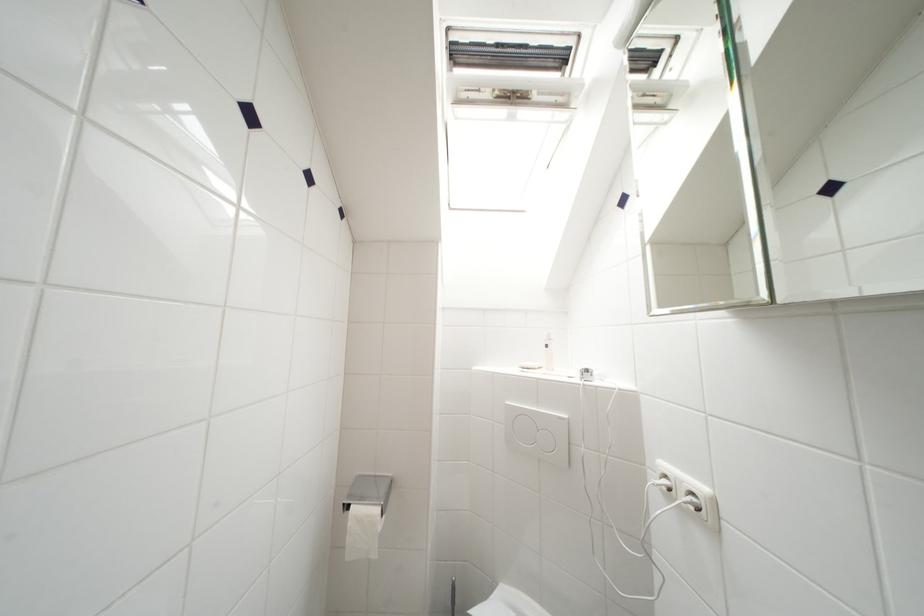
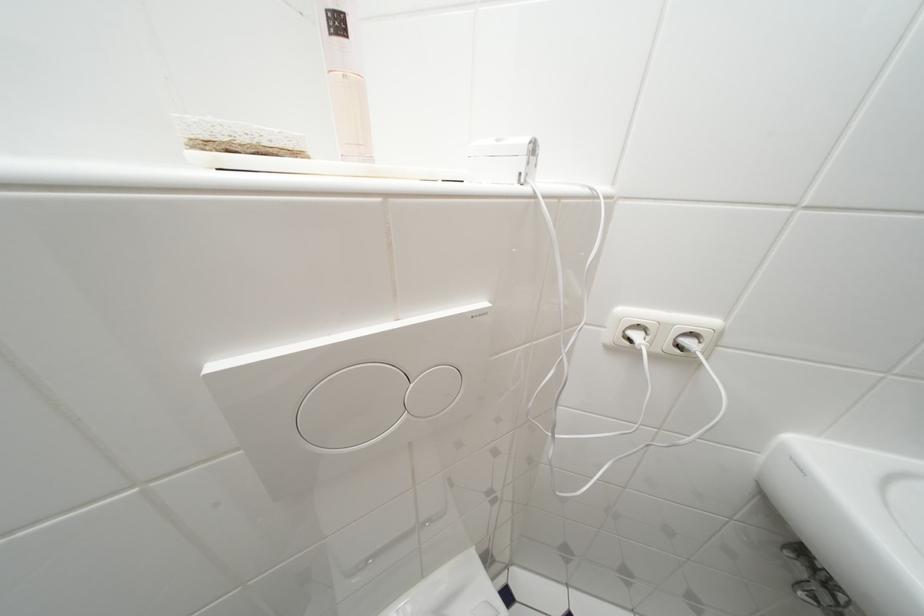
The first image is from the beginning of the video and the second image is from the end. How did the camera likely rotate when shooting the video?

The camera rotated toward right-down.